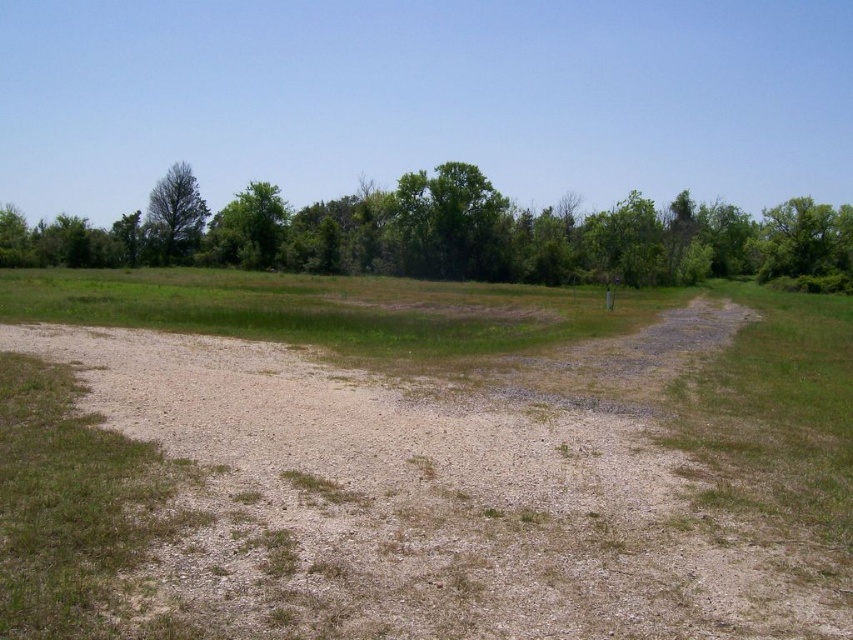
You are standing on the brown gravel dirt track at center and want to walk towards the green leafy tree at right. Which direction should you head to get closer to the tree?

Since the brown gravel dirt track at center is closer to the viewer than the green leafy tree at right, you should head towards the right along the gravel path to approach the tree.

You are standing at the point marked as point (450, 224) in the image. Looking around, you see a gravel path curving to the right and a grassy field. Which direction should you walk to reach the green leafy tree at center?

The point (450, 224) is located on the green leafy tree at center, so you are already at the tree.